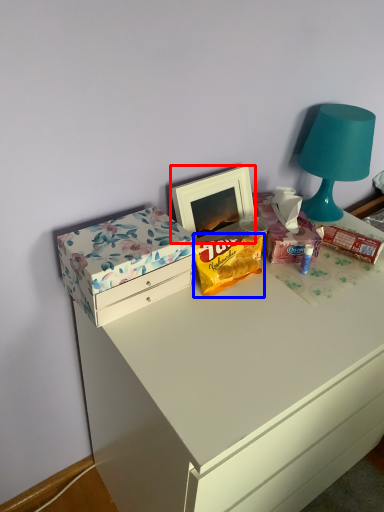
Question: Which object appears farthest to the camera in this image, picture frame (highlighted by a red box) or snack (highlighted by a blue box)?

Choices:
 (A) picture frame
 (B) snack

Answer: (A)